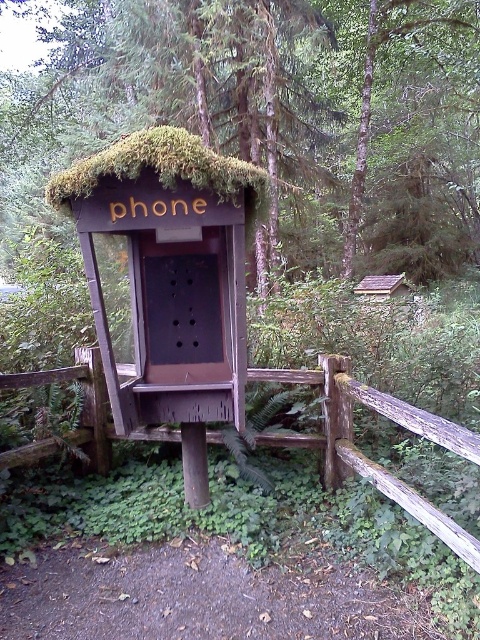
Find the location of `wooden phone booth at center`. wooden phone booth at center is located at coordinates (169, 269).

Which is in front, point (471, 40) or point (64, 189)?

Point (64, 189)

In order to click on green mossy roof at center in this screenshot , I will do `click(296, 104)`.

Image resolution: width=480 pixels, height=640 pixels. In order to click on green mossy roof at center in this screenshot , I will do `click(296, 104)`.

What are the coordinates of `green mossy roof at center` in the screenshot? It's located at (296, 104).

Is point (177, 161) positioned in front of point (99, 387)?

Yes, point (177, 161) is closer to viewer.

Who is more distant from viewer, (79,204) or (324,378)?

Positioned behind is point (324,378).

Describe the element at coordinates (169, 269) in the screenshot. I see `wooden phone booth at center` at that location.

The image size is (480, 640). Find the location of `wooden phone booth at center`. wooden phone booth at center is located at coordinates (169, 269).